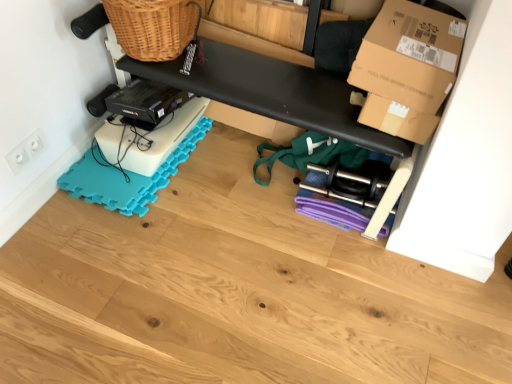
The image size is (512, 384). I want to click on teal foam yoga mat at lower left, so click(x=124, y=178).

What do you see at coordinates (24, 151) in the screenshot?
I see `white plastic electrical outlet at lower left` at bounding box center [24, 151].

The image size is (512, 384). What do you see at coordinates (271, 92) in the screenshot?
I see `black matte bench at upper center` at bounding box center [271, 92].

What do you see at coordinates (236, 292) in the screenshot? I see `wooden floor at lower center` at bounding box center [236, 292].

Identify the location of teal foam yoga mat at lower left. (124, 178).

Which of these two, teal foam yoga mat at lower left or brown cardboard box at upper right, stands taller?

With more height is brown cardboard box at upper right.

Would you say brown cardboard box at upper right is part of teal foam yoga mat at lower left's contents?

Actually, brown cardboard box at upper right is outside teal foam yoga mat at lower left.

Would you say teal foam yoga mat at lower left is a long distance from brown cardboard box at upper right?

No, there isn't a large distance between teal foam yoga mat at lower left and brown cardboard box at upper right.

Who is bigger, teal foam yoga mat at lower left or brown cardboard box at upper right?

brown cardboard box at upper right is bigger.

Considering the points (19, 163) and (28, 375), which point is in front, point (19, 163) or point (28, 375)?

The point (28, 375) is more forward.

Identify the location of electric outlet on the left of wooden floor at lower center. (24, 151).

In the scene shown: Are white plastic electrical outlet at lower left and wooden floor at lower center making contact?

No, white plastic electrical outlet at lower left is not making contact with wooden floor at lower center.

Is white plastic electrical outlet at lower left bigger or smaller than wooden floor at lower center?

In the image, white plastic electrical outlet at lower left appears to be smaller than wooden floor at lower center.

Can we say white plastic electrical outlet at lower left lies outside teal foam yoga mat at lower left?

Yes, white plastic electrical outlet at lower left is outside of teal foam yoga mat at lower left.

Is white plastic electrical outlet at lower left oriented away from teal foam yoga mat at lower left?

No, white plastic electrical outlet at lower left is not facing away from teal foam yoga mat at lower left.

From the image's perspective, which object appears higher, white plastic electrical outlet at lower left or teal foam yoga mat at lower left?

teal foam yoga mat at lower left appears higher in the image.

From the picture: Would you say white plastic electrical outlet at lower left is to the left or to the right of teal foam yoga mat at lower left in the picture?

white plastic electrical outlet at lower left is positioned on teal foam yoga mat at lower left's left side.

Does point (414, 90) lie behind point (15, 174)?

No, it is in front of (15, 174).

Does brown cardboard box at upper right have a lesser height compared to white plastic electrical outlet at lower left?

Incorrect, the height of brown cardboard box at upper right does not fall short of that of white plastic electrical outlet at lower left.

Choose the correct answer: Is brown cardboard box at upper right inside white plastic electrical outlet at lower left or outside it?

The correct answer is: outside.

Between brown cardboard box at upper right and white plastic electrical outlet at lower left, which one is positioned in front?

brown cardboard box at upper right.

Is point (340, 84) behind point (124, 201)?

No, (340, 84) is closer to viewer.

In the image, is black matte bench at upper center positioned in front of or behind teal foam yoga mat at lower left?

In the image, black matte bench at upper center appears in front of teal foam yoga mat at lower left.

Visually, is black matte bench at upper center positioned to the left or to the right of teal foam yoga mat at lower left?

From the image, it's evident that black matte bench at upper center is to the right of teal foam yoga mat at lower left.

At what (x,y) coordinates should I click in order to perform the action: click on shelf in front of the teal foam yoga mat at lower left. Please return your answer as a coordinate pair (x, y). The width and height of the screenshot is (512, 384). Looking at the image, I should click on (271, 92).

Which object is further away from the camera, wooden floor at lower center or white plastic electrical outlet at lower left?

white plastic electrical outlet at lower left is behind.

Considering the positions of objects wooden floor at lower center and white plastic electrical outlet at lower left in the image provided, who is more to the right, wooden floor at lower center or white plastic electrical outlet at lower left?

From the viewer's perspective, wooden floor at lower center appears more on the right side.

Looking at this image, is wooden floor at lower center not inside white plastic electrical outlet at lower left?

Yes, wooden floor at lower center is not within white plastic electrical outlet at lower left.

Does black matte bench at upper center turn towards wooden floor at lower center?

Yes, black matte bench at upper center is facing wooden floor at lower center.

Where is `wood below the black matte bench at upper center (from a real-world perspective)`? wood below the black matte bench at upper center (from a real-world perspective) is located at coordinates (236, 292).

Between black matte bench at upper center and wooden floor at lower center, which one appears on the left side from the viewer's perspective?

Positioned to the left is black matte bench at upper center.

This screenshot has height=384, width=512. I want to click on box lying above the teal foam yoga mat at lower left (from the image's perspective), so [x=410, y=55].

Locate an element on the screen. This screenshot has width=512, height=384. wood in front of the white plastic electrical outlet at lower left is located at coordinates (236, 292).

From the image, which object appears to be nearer to wooden floor at lower center, brown cardboard box at upper right or teal foam yoga mat at lower left?

teal foam yoga mat at lower left is positioned closer to the anchor wooden floor at lower center.

From the image, which object appears to be nearer to teal foam yoga mat at lower left, wooden floor at lower center or brown cardboard box at upper right?

wooden floor at lower center lies closer to teal foam yoga mat at lower left than the other object.

Consider the image. Based on their spatial positions, is brown cardboard box at upper right or black matte bench at upper center further from wooden floor at lower center?

The object further to wooden floor at lower center is brown cardboard box at upper right.

Which object lies nearer to the anchor point black matte bench at upper center, brown cardboard box at upper right or white plastic electrical outlet at lower left?

brown cardboard box at upper right is positioned closer to the anchor black matte bench at upper center.

Estimate the real-world distances between objects in this image. Which object is closer to teal foam yoga mat at lower left, brown cardboard box at upper right or wooden floor at lower center?

The object closer to teal foam yoga mat at lower left is wooden floor at lower center.

From the image, which object appears to be farther from teal foam yoga mat at lower left, wooden floor at lower center or black matte bench at upper center?

Among the two, black matte bench at upper center is located further to teal foam yoga mat at lower left.

From the picture: Looking at the image, which one is located further to teal foam yoga mat at lower left, white plastic electrical outlet at lower left or brown cardboard box at upper right?

brown cardboard box at upper right is further to teal foam yoga mat at lower left.

When comparing their distances from brown cardboard box at upper right, does teal foam yoga mat at lower left or wooden floor at lower center seem closer?

Among the two, wooden floor at lower center is located nearer to brown cardboard box at upper right.

Image resolution: width=512 pixels, height=384 pixels. I want to click on yoga mat between white plastic electrical outlet at lower left and wooden floor at lower center, so click(x=124, y=178).

At what (x,y) coordinates should I click in order to perform the action: click on shelf between teal foam yoga mat at lower left and brown cardboard box at upper right from left to right. Please return your answer as a coordinate pair (x, y). This screenshot has height=384, width=512. Looking at the image, I should click on (271, 92).

Image resolution: width=512 pixels, height=384 pixels. In order to click on shelf between white plastic electrical outlet at lower left and wooden floor at lower center in this screenshot , I will do `click(271, 92)`.

You are a GUI agent. You are given a task and a screenshot of the screen. Output one action in this format:
    pyautogui.click(x=<x>, y=<y>)
    Task: Click on the shelf located between wooden floor at lower center and teal foam yoga mat at lower left in the depth direction
    The image size is (512, 384).
    Given the screenshot: What is the action you would take?
    pyautogui.click(x=271, y=92)